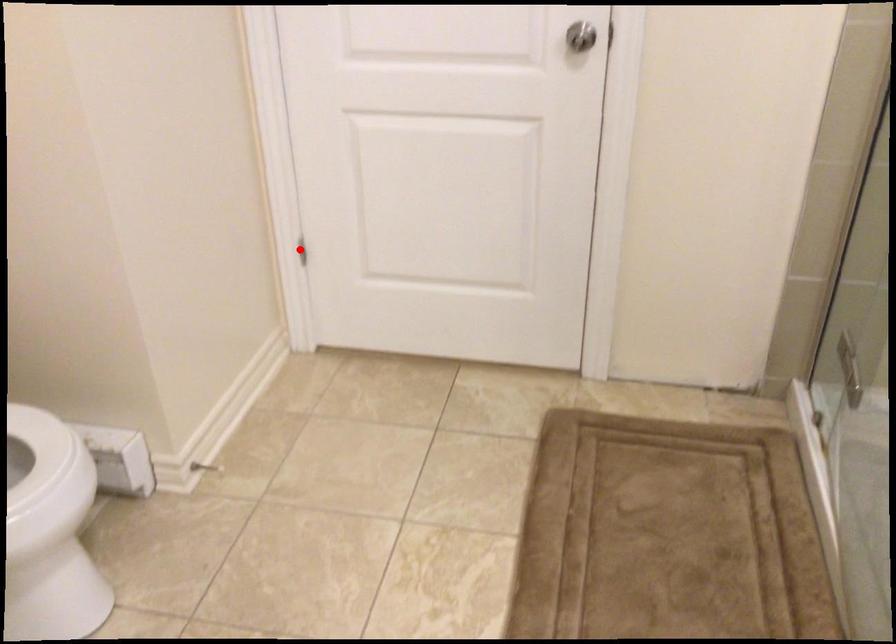
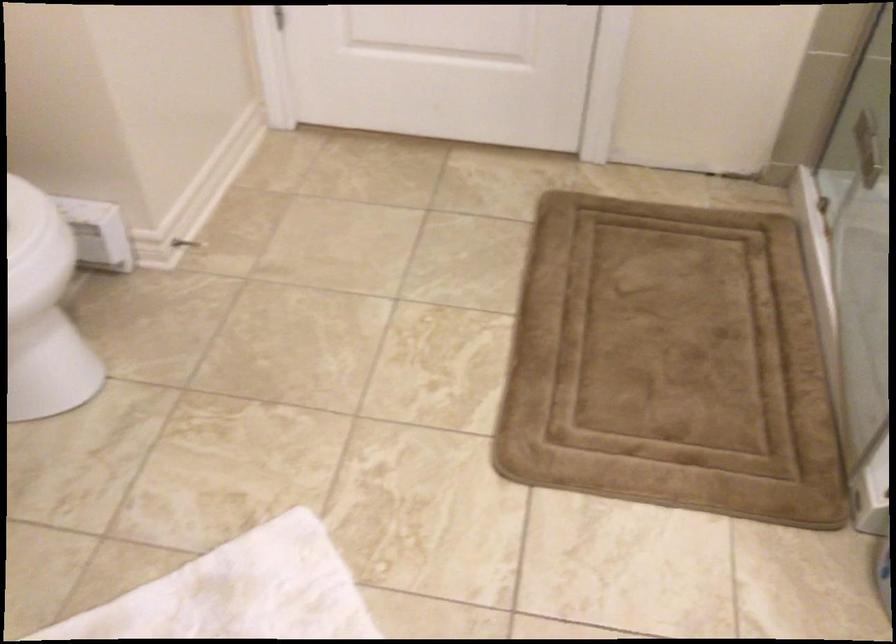
Where in the second image is the point corresponding to the highlighted location from the first image?

(274, 17)